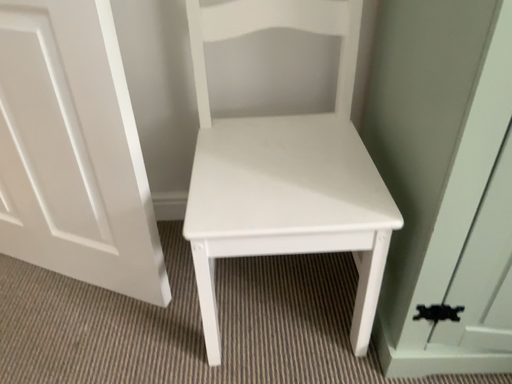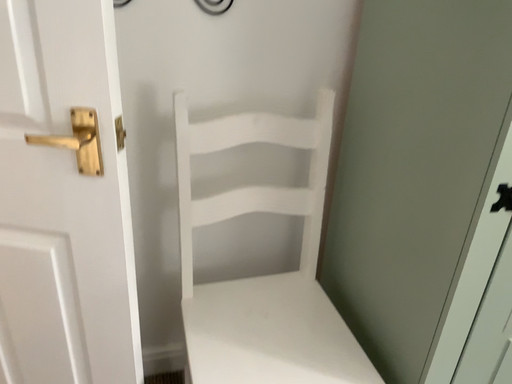
Question: Which way did the camera rotate in the video?

Choices:
 (A) rotated downward
 (B) rotated upward

Answer: (B)